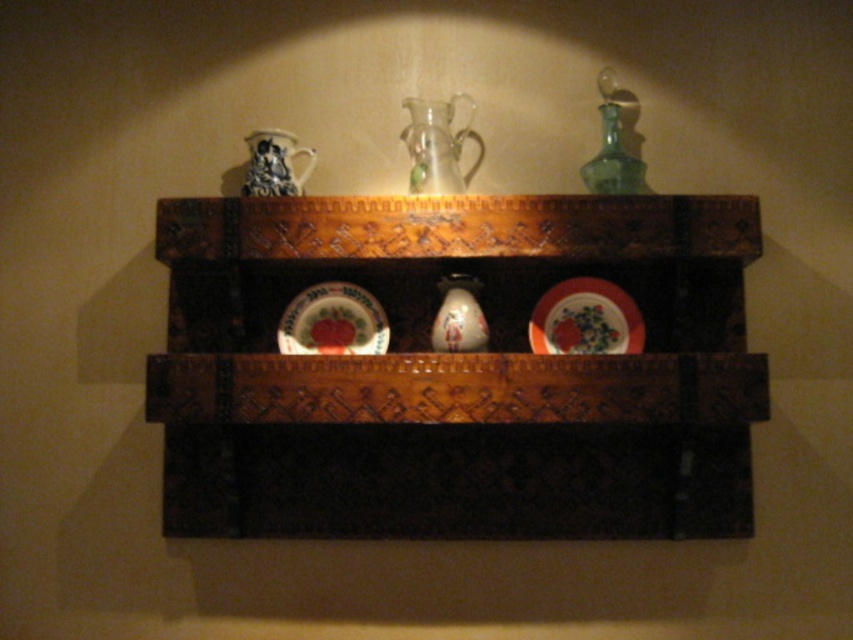
Between porcelain plate at center and green glass bottle at upper right, which one has more height?

Standing taller between the two is green glass bottle at upper right.

Which is behind, point (618, 337) or point (595, 172)?

The point (618, 337) is more distant.

Who is more distant from viewer, (576, 282) or (619, 132)?

The point (619, 132) is more distant.

Where is `porcelain plate at center`? This screenshot has width=853, height=640. porcelain plate at center is located at coordinates (585, 320).

Is porcelain plate at center wider than blue and white porcelain jug at upper left?

Yes, porcelain plate at center is wider than blue and white porcelain jug at upper left.

Between porcelain plate at center and blue and white porcelain jug at upper left, which one is positioned lower?

porcelain plate at center

This screenshot has height=640, width=853. In order to click on porcelain plate at center in this screenshot , I will do `click(585, 320)`.

Between point (608, 320) and point (486, 348), which one is positioned behind?

Positioned behind is point (608, 320).

Is point (587, 307) in front of point (485, 333)?

No, it is not.

Does point (595, 336) come behind point (434, 317)?

No.

Where is `porcelain plate at center`? The image size is (853, 640). porcelain plate at center is located at coordinates (585, 320).